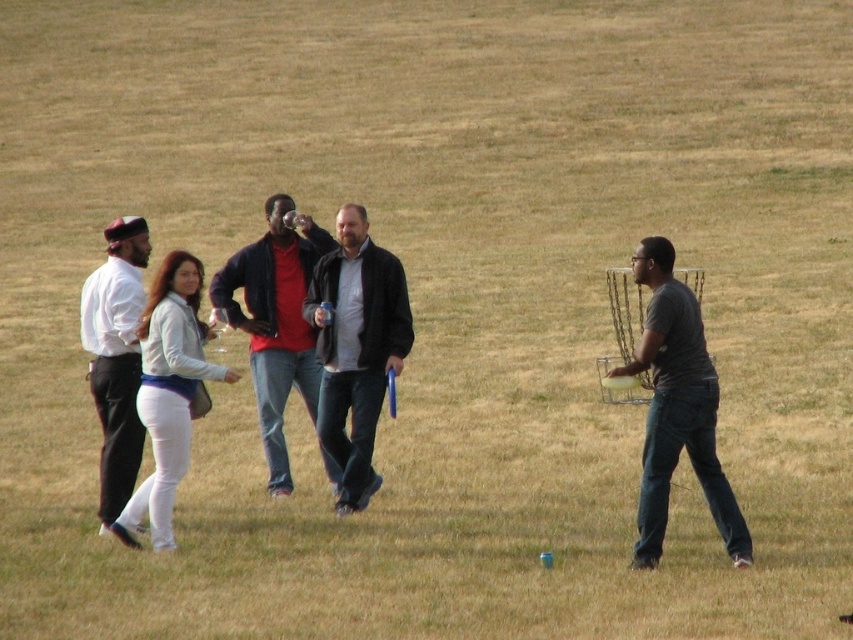
Which is behind, point (733, 502) or point (189, 365)?

Positioned behind is point (189, 365).

Can you confirm if gray matte t-shirt at right is taller than white matte jacket at center?

Correct, gray matte t-shirt at right is much taller as white matte jacket at center.

Is point (659, 474) closer to viewer compared to point (180, 289)?

Yes, it is in front of point (180, 289).

This screenshot has width=853, height=640. In order to click on gray matte t-shirt at right in this screenshot , I will do `click(677, 408)`.

Does matte black jacket at center have a smaller size compared to white matte shirt at left?

Indeed, matte black jacket at center has a smaller size compared to white matte shirt at left.

Who is higher up, matte black jacket at center or white matte shirt at left?

Positioned higher is matte black jacket at center.

I want to click on matte black jacket at center, so click(276, 321).

You are a GUI agent. You are given a task and a screenshot of the screen. Output one action in this format:
    pyautogui.click(x=<x>, y=<y>)
    Task: Click on the matte black jacket at center
    The image size is (853, 640).
    Given the screenshot: What is the action you would take?
    pyautogui.click(x=276, y=321)

Who is taller, dark gray jacket at center or white matte jacket at center?

With more height is dark gray jacket at center.

Is dark gray jacket at center thinner than white matte jacket at center?

Correct, dark gray jacket at center's width is less than white matte jacket at center's.

Is point (373, 422) less distant than point (135, 540)?

No, it is not.

You are a GUI agent. You are given a task and a screenshot of the screen. Output one action in this format:
    pyautogui.click(x=<x>, y=<y>)
    Task: Click on the dark gray jacket at center
    
    Given the screenshot: What is the action you would take?
    pyautogui.click(x=357, y=348)